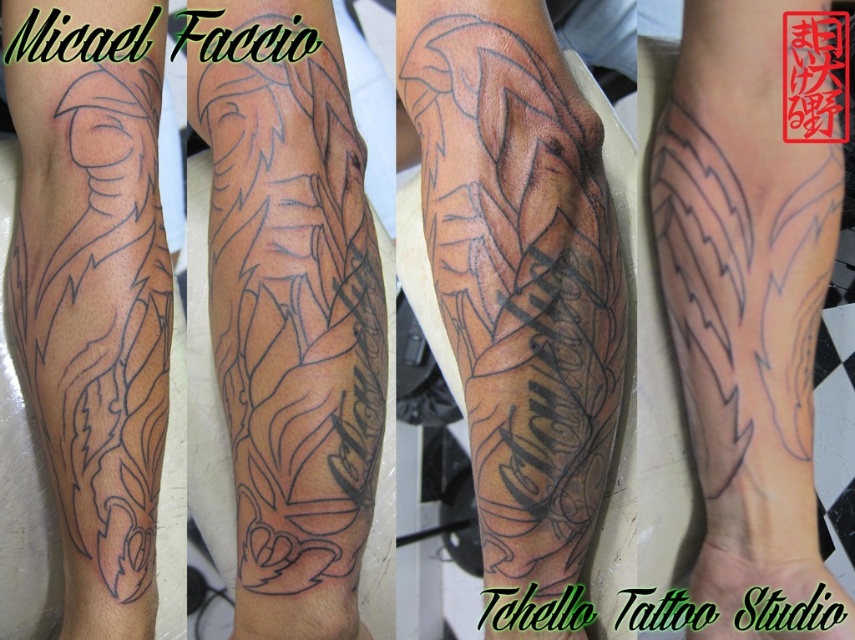
Question: Which point is farther from the camera taking this photo?

Choices:
 (A) (19, 346)
 (B) (682, 211)

Answer: (B)

Question: Which of the following is the farthest from the observer?

Choices:
 (A) (741, 180)
 (B) (551, 168)

Answer: (A)

Question: Can you confirm if black ink tattoo at upper center is thinner than black ink feather at center?

Choices:
 (A) yes
 (B) no

Answer: (B)

Question: Is black ink tattoo at upper center positioned at the back of black ink feather at center?

Choices:
 (A) yes
 (B) no

Answer: (B)

Question: Which point is farther to the camera?

Choices:
 (A) black ink feather at center
 (B) black outline tattoo at left
 (C) black ink tattoo at center
 (D) black ink tattoo at upper center

Answer: (A)

Question: Does black ink tattoo at upper center appear on the right side of black ink feather at center?

Choices:
 (A) yes
 (B) no

Answer: (B)